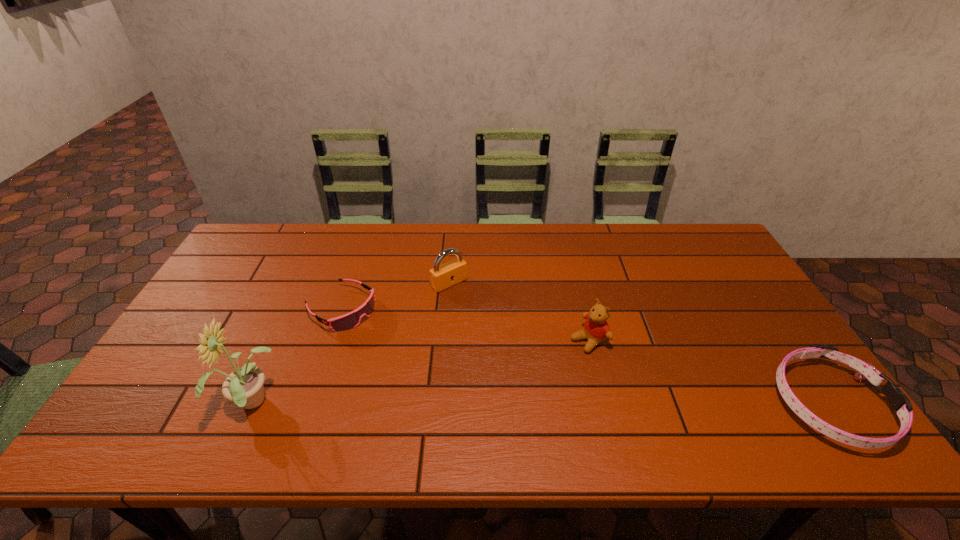
Identify the location of object at the near right corner. The height and width of the screenshot is (540, 960). (900, 403).

The image size is (960, 540). In the image, there is a desktop. In order to click on vacant space at the far edge in this screenshot , I will do `click(616, 249)`.

Locate an element on the screen. The width and height of the screenshot is (960, 540). vacant space at the near edge of the desktop is located at coordinates (303, 408).

The height and width of the screenshot is (540, 960). In order to click on vacant area at the left edge of the desktop in this screenshot , I will do coord(193,333).

At what (x,y) coordinates should I click in order to perform the action: click on blank space at the right edge of the desktop. Please return your answer as a coordinate pair (x, y). The width and height of the screenshot is (960, 540). Looking at the image, I should click on (711, 274).

In the image, there is a desktop. At what (x,y) coordinates should I click in order to perform the action: click on free region at the far right corner. Please return your answer as a coordinate pair (x, y). The image size is (960, 540). Looking at the image, I should click on [687, 264].

You are a GUI agent. You are given a task and a screenshot of the screen. Output one action in this format:
    pyautogui.click(x=<x>, y=<y>)
    Task: Click on the vacant space at the near right corner of the desktop
    This screenshot has height=540, width=960.
    Given the screenshot: What is the action you would take?
    pyautogui.click(x=779, y=410)

At what (x,y) coordinates should I click in order to perform the action: click on free space that is in between the rightmost object and the sunflower. Please return your answer as a coordinate pair (x, y). The height and width of the screenshot is (540, 960). Looking at the image, I should click on (541, 404).

Locate an element on the screen. empty location between the goggles and the padlock is located at coordinates (396, 295).

This screenshot has width=960, height=540. I want to click on vacant point located between the rightmost object and the second object from right to left, so pyautogui.click(x=708, y=372).